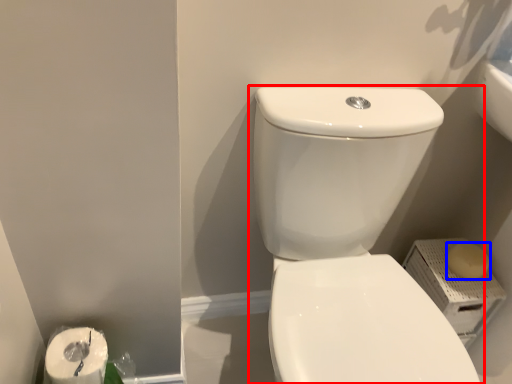
Question: Which of the following is the farthest to the observer, toilet (highlighted by a red box) or soap (highlighted by a blue box)?

Choices:
 (A) toilet
 (B) soap

Answer: (B)